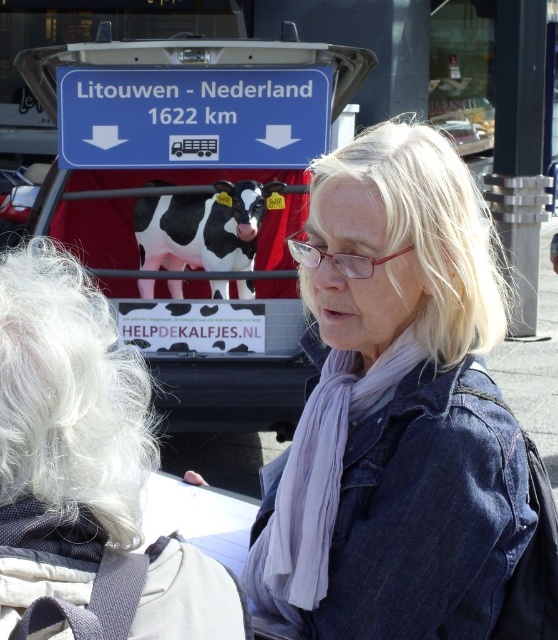
Looking at this image, you are a photographer trying to capture a photo of the blue plastic sign at upper center without including the denim jacket at center in the frame. Based on their positions, is this possible?

The denim jacket at center is to the right of the blue plastic sign at upper center, so by adjusting the camera angle to focus on the left side of the blue plastic sign at upper center, it is possible to exclude the denim jacket at center from the frame.

Based on the photo, you are a photographer trying to capture both the blue plastic sign at upper center and the linen scarf at center in a single frame. Based on their positions, which object should you focus on first to ensure both are in the frame?

The blue plastic sign at upper center is above the linen scarf at center, so you should focus on the linen scarf at center first to ensure both are within the frame.